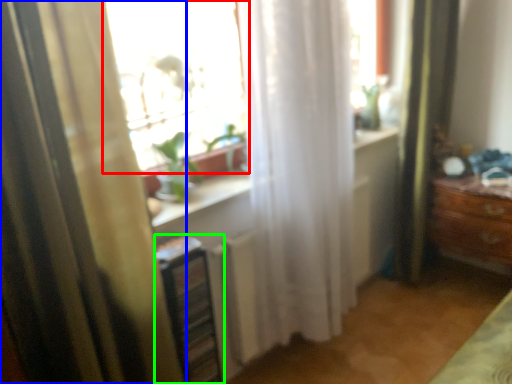
Question: Considering the real-world distances, which object is closest to window (highlighted by a red box)? curtain (highlighted by a blue box) or shelf (highlighted by a green box).

Choices:
 (A) curtain
 (B) shelf

Answer: (B)